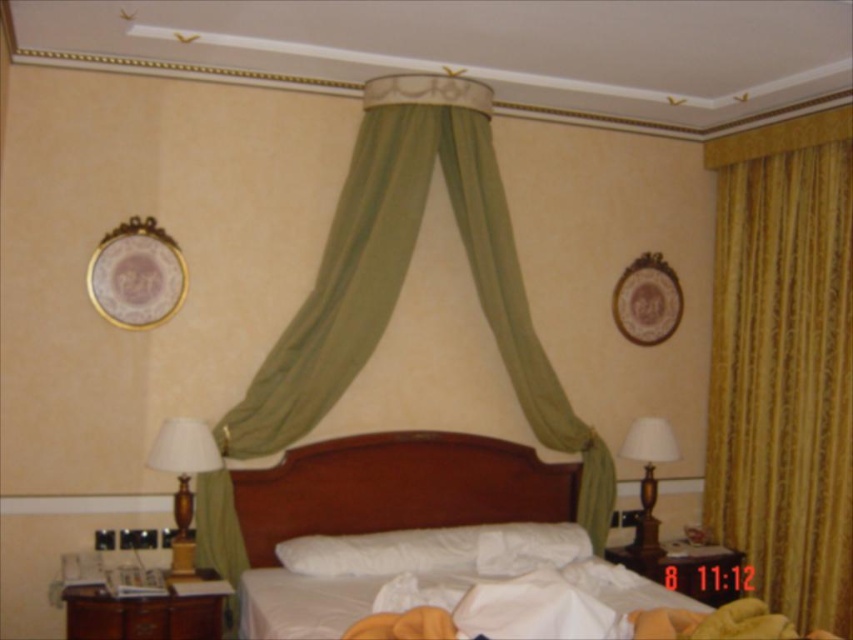
Is matte gold lamp at left to the right of matte brown lamp at right from the viewer's perspective?

In fact, matte gold lamp at left is to the left of matte brown lamp at right.

Between matte gold lamp at left and matte brown lamp at right, which one appears on the left side from the viewer's perspective?

From the viewer's perspective, matte gold lamp at left appears more on the left side.

Does point (170, 467) come closer to viewer compared to point (643, 560)?

Yes.

In order to click on matte gold lamp at left in this screenshot , I will do `click(183, 477)`.

Does green sheer curtain at center have a smaller size compared to matte gold lamp at left?

No.

Can you confirm if green sheer curtain at center is thinner than matte gold lamp at left?

In fact, green sheer curtain at center might be wider than matte gold lamp at left.

Describe the element at coordinates (403, 278) in the screenshot. I see `green sheer curtain at center` at that location.

Locate an element on the screen. green sheer curtain at center is located at coordinates (403, 278).

Measure the distance between gold textured curtain at right and green sheer curtain at center.

The distance of gold textured curtain at right from green sheer curtain at center is 4.62 feet.

Image resolution: width=853 pixels, height=640 pixels. What do you see at coordinates (784, 362) in the screenshot? I see `gold textured curtain at right` at bounding box center [784, 362].

The height and width of the screenshot is (640, 853). What are the coordinates of `gold textured curtain at right` in the screenshot? It's located at (784, 362).

The width and height of the screenshot is (853, 640). What are the coordinates of `gold textured curtain at right` in the screenshot? It's located at (784, 362).